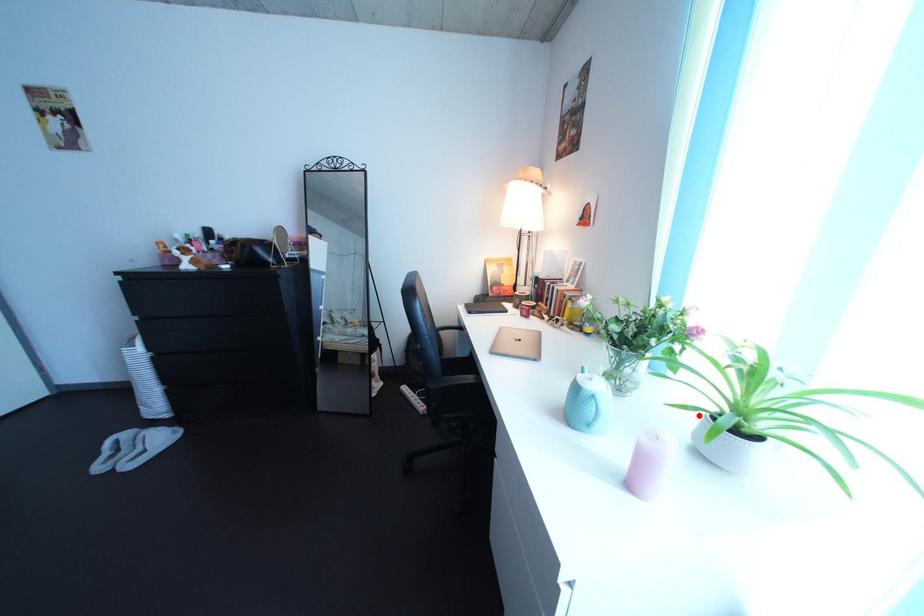
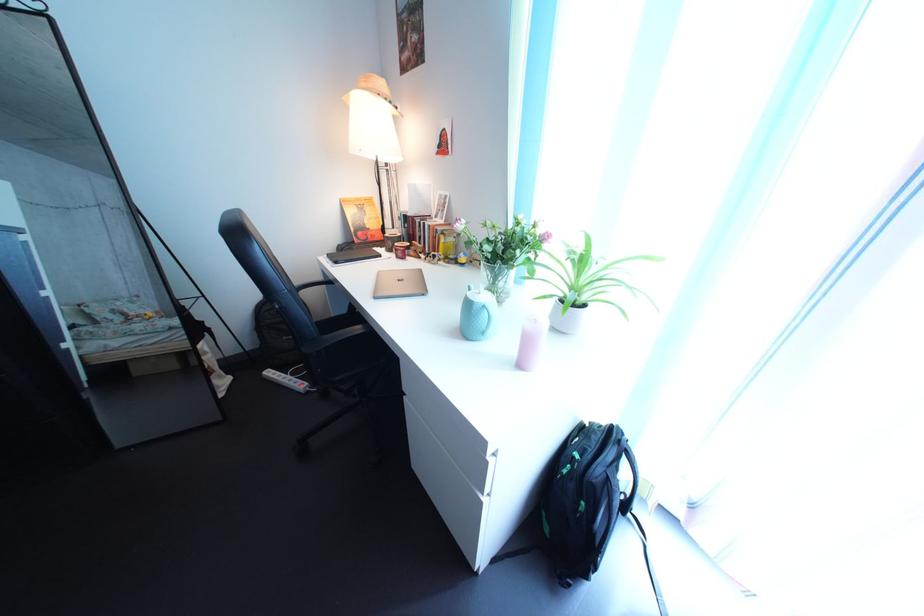
The point at the highlighted location is marked in the first image. Where is the corresponding point in the second image?

(560, 305)